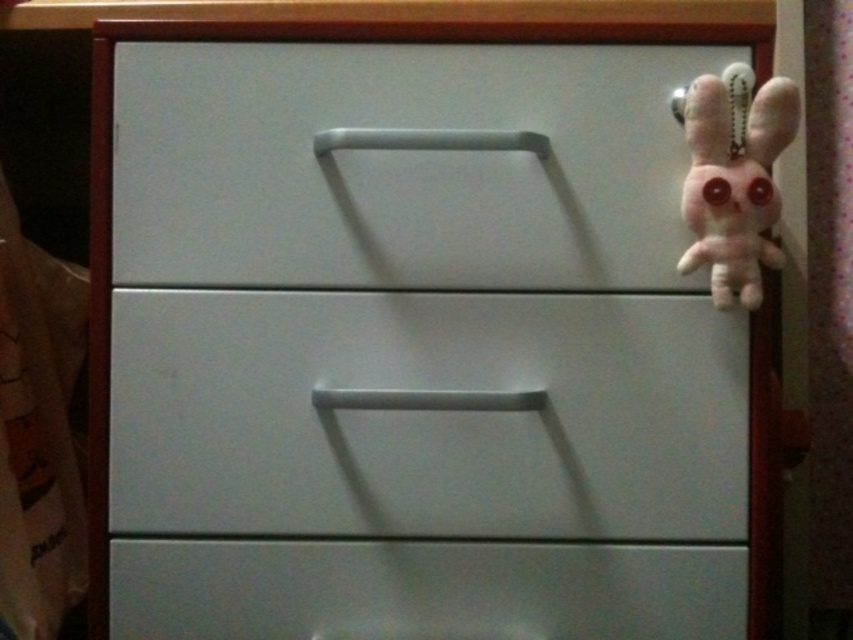
Question: Estimate the real-world distances between objects in this image. Which object is farther from the white matte drawer at center?

Choices:
 (A) fluffy pink plush at upper right
 (B) white matte drawer at upper center

Answer: (A)

Question: Can you confirm if satin white drawer at lower center is bigger than fluffy pink plush at upper right?

Choices:
 (A) yes
 (B) no

Answer: (B)

Question: Does white matte drawer at upper center have a lesser width compared to satin white drawer at lower center?

Choices:
 (A) no
 (B) yes

Answer: (B)

Question: Is white matte drawer at upper center to the right of fluffy pink plush at upper right from the viewer's perspective?

Choices:
 (A) yes
 (B) no

Answer: (B)

Question: Which point is farther to the camera?

Choices:
 (A) (434, 561)
 (B) (167, 392)
 (C) (241, 225)

Answer: (A)

Question: Which point is farther to the camera?

Choices:
 (A) (573, 484)
 (B) (743, 118)
 (C) (595, 564)

Answer: (C)